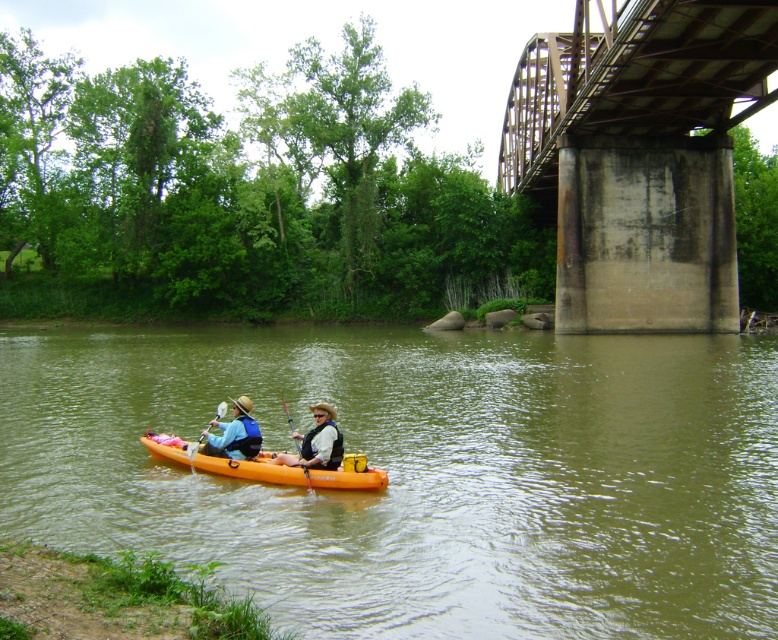
You are a photographer trying to capture the white matte life vest at center in your shot. Based on the scene description, where should you position your camera to ensure the life vest is centered in the frame?

To center the white matte life vest at center in the frame, position your camera so that the life vest is located at the coordinates 0.692 on the horizontal axis and 0.407 on the vertical axis within the image plane.

You are standing at the camera position and want to throw a lifebuoy to the orange matte kayak at center. The lifebuoy can travel 10 meters. Do you think it will reach the kayak?

The orange matte kayak at center and camera are 10.50 meters apart from each other. Since the lifebuoy can travel 10 meters, it cannot reach the kayak as the distance is greater than the lifebuoy range.

You are a photographer positioned on the riverbank. You want to take a photo of the orange matte kayak at center and the wooden paddle at center. Which object will appear larger in your photo?

The orange matte kayak at center will appear larger in the photo because it is closer to the viewer than the wooden paddle at center.